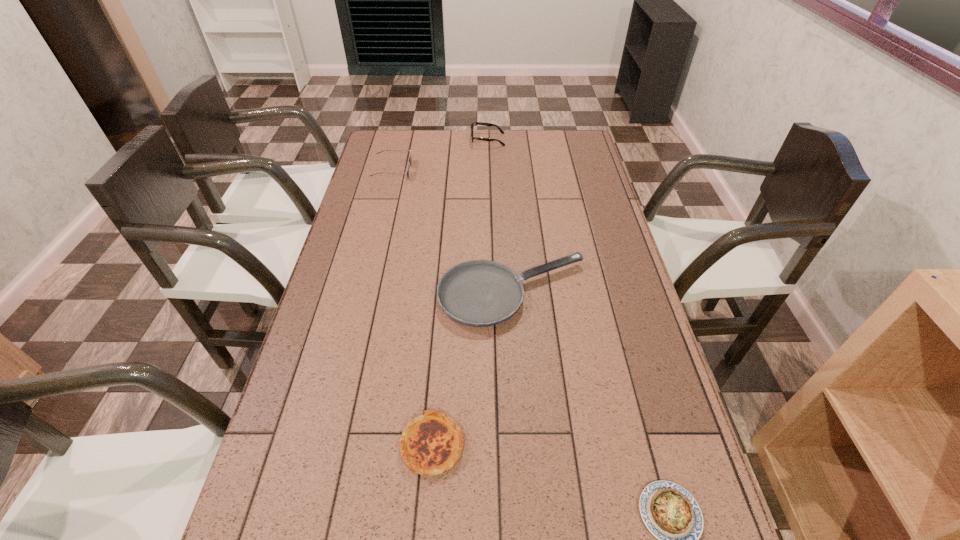
Where is `the farthest object`? This screenshot has width=960, height=540. the farthest object is located at coordinates [477, 123].

Where is `the second farthest object`? The height and width of the screenshot is (540, 960). the second farthest object is located at coordinates pyautogui.click(x=410, y=159).

Find the location of a particular element. sunglasses is located at coordinates (410, 159).

At what (x,y) coordinates should I click in order to perform the action: click on frying pan. Please return your answer as a coordinate pair (x, y). Looking at the image, I should click on (480, 293).

Image resolution: width=960 pixels, height=540 pixels. Find the location of `the third shortest object`. the third shortest object is located at coordinates (480, 293).

This screenshot has height=540, width=960. I want to click on the farther quiche, so click(431, 444).

Locate an element on the screen. This screenshot has height=540, width=960. the taller quiche is located at coordinates (431, 444).

Where is `free space located 0.130m on the lenses of the spectacles`? free space located 0.130m on the lenses of the spectacles is located at coordinates (441, 140).

The image size is (960, 540). Find the location of `free location located 0.250m on the lenses of the spectacles`. free location located 0.250m on the lenses of the spectacles is located at coordinates (413, 140).

Image resolution: width=960 pixels, height=540 pixels. In order to click on vacant region located 0.240m on the lenses of the spectacles in this screenshot , I will do 415,140.